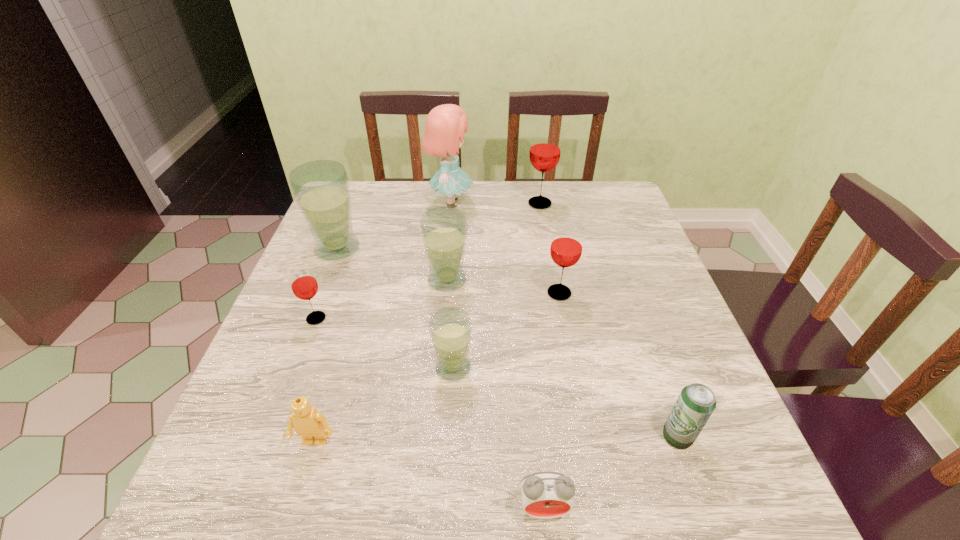
I want to click on vacant space situated 0.340m on the back of the second nearest blue glass, so click(x=454, y=195).

You are a GUI agent. You are given a task and a screenshot of the screen. Output one action in this format:
    pyautogui.click(x=<x>, y=<y>)
    Task: Click on the free space located 0.110m on the right of the second nearest glass
    
    Given the screenshot: What is the action you would take?
    pyautogui.click(x=377, y=319)

This screenshot has height=540, width=960. Find the location of `free space located 0.200m on the left of the nearest blue glass`. free space located 0.200m on the left of the nearest blue glass is located at coordinates (334, 368).

The height and width of the screenshot is (540, 960). What are the coordinates of `vacant area located 0.070m on the left of the beer can` in the screenshot? It's located at click(622, 436).

Identify the location of free spot located on the face of the Lego. Image resolution: width=960 pixels, height=540 pixels. (292, 522).

I want to click on doll located at the far edge, so click(x=445, y=125).

The height and width of the screenshot is (540, 960). I want to click on glass that is at the far edge, so click(x=545, y=148).

Image resolution: width=960 pixels, height=540 pixels. I want to click on object positioned at the near edge, so click(x=545, y=495).

Find the location of a particular element. This screenshot has width=960, height=540. Lego present at the left edge is located at coordinates (308, 423).

Image resolution: width=960 pixels, height=540 pixels. I want to click on object present at the right edge, so click(x=696, y=402).